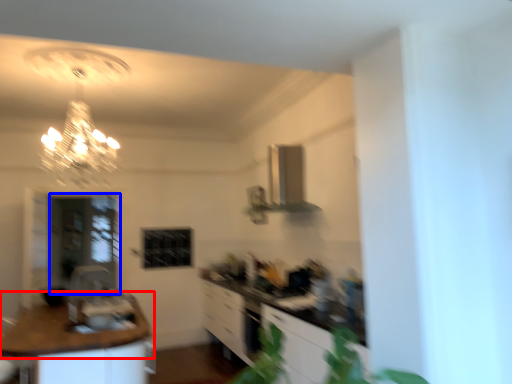
Question: Which object appears farthest to the camera in this image, countertop (highlighted by a red box) or glass door (highlighted by a blue box)?

Choices:
 (A) countertop
 (B) glass door

Answer: (B)